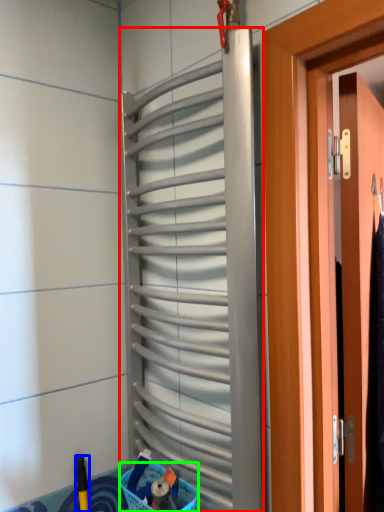
Question: Estimate the real-world distances between objects in this image. Which object is farther from shutter (highlighted by a red box), brush (highlighted by a blue box) or basket (highlighted by a green box)?

Choices:
 (A) brush
 (B) basket

Answer: (A)